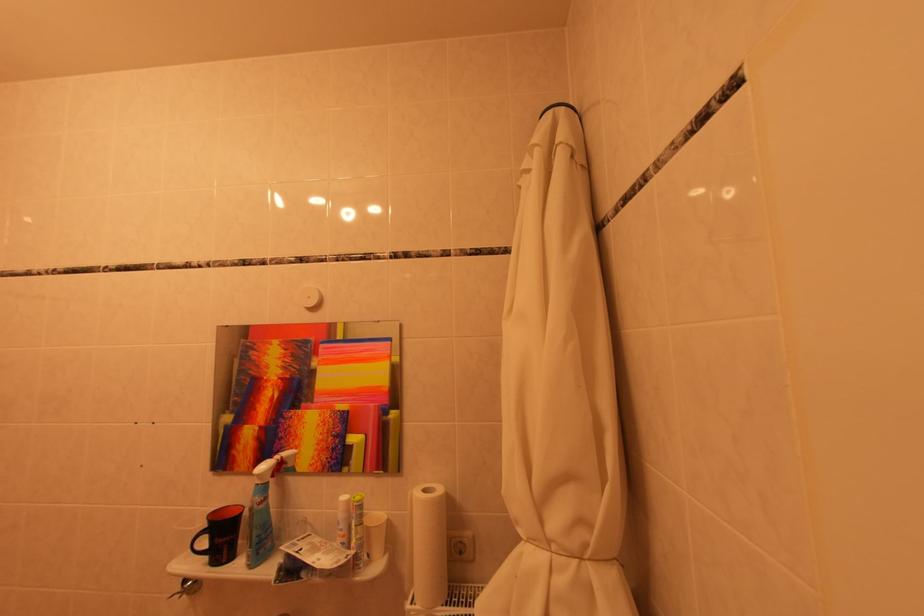
This screenshot has width=924, height=616. What do you see at coordinates (561, 108) in the screenshot?
I see `the shower curtain ring` at bounding box center [561, 108].